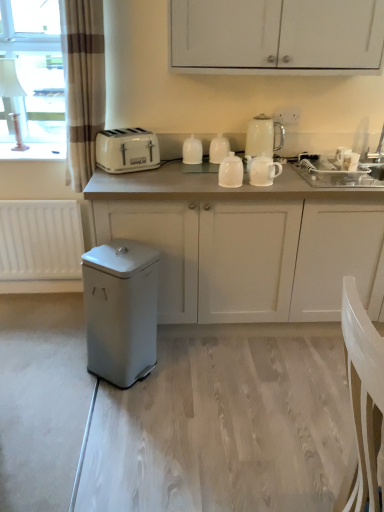
Identify the location of free spot below white matte radiator at lower left (from a real-world perspective). The width and height of the screenshot is (384, 512). (42, 295).